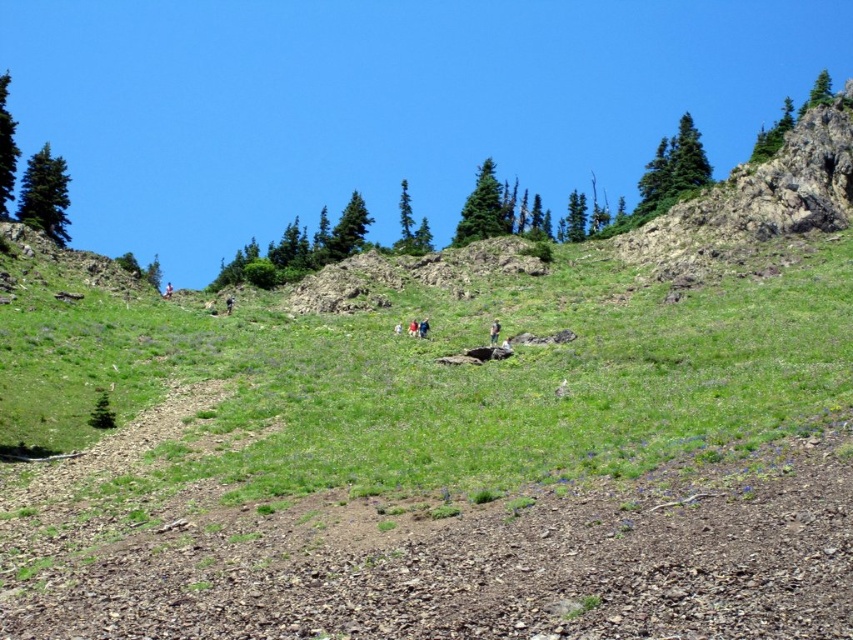
You are a hiker trying to navigate through the rugged terrain in the foreground of the mountain scene. You see two landmarks marked as point (238, 381) and point (492, 324). Which point should you head towards first if you want to reach the nearest landmark first?

You should head towards point (238, 381) first because it is closer to the viewer than point (492, 324).

Consider the image. You are planning to take a photo of the light brown fabric jacket at center from the green grassy at center. Can you see the jacket clearly in the photo?

The green grassy at center is in front of the light brown fabric jacket at center, so the jacket may be partially or fully obscured by the grass in the photo.